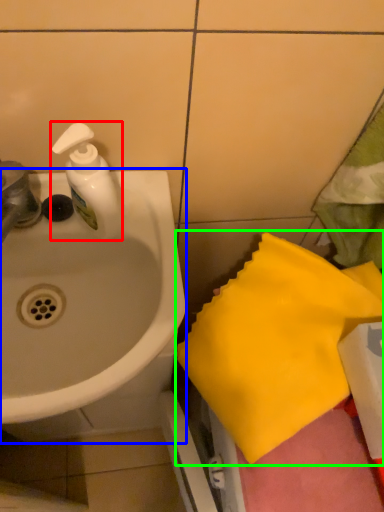
Question: Considering the real-world distances, which object is farthest from soap dispenser (highlighted by a red box)? sink (highlighted by a blue box) or beach towel (highlighted by a green box)?

Choices:
 (A) sink
 (B) beach towel

Answer: (B)